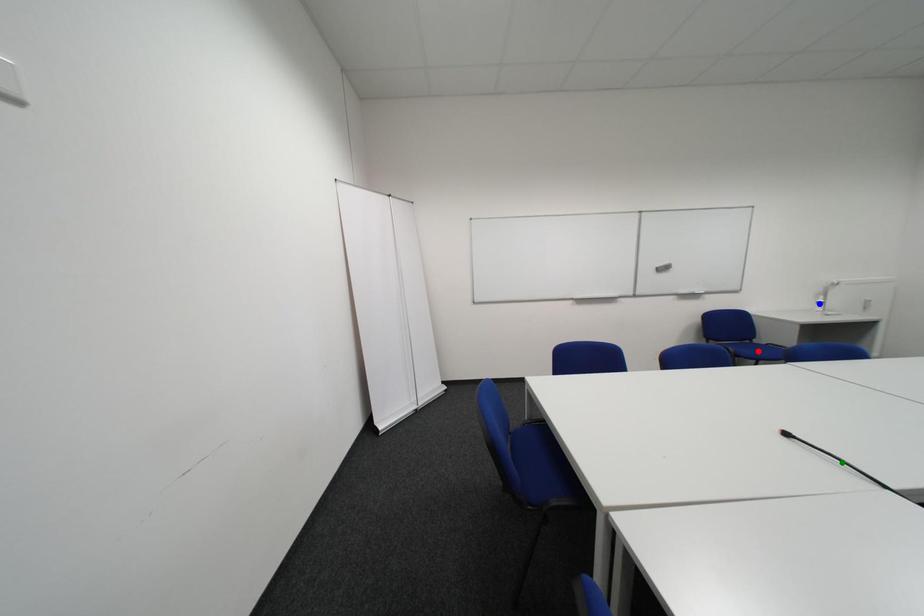
Order these from nearest to farthest:
1. blue point
2. green point
3. red point

green point
red point
blue point